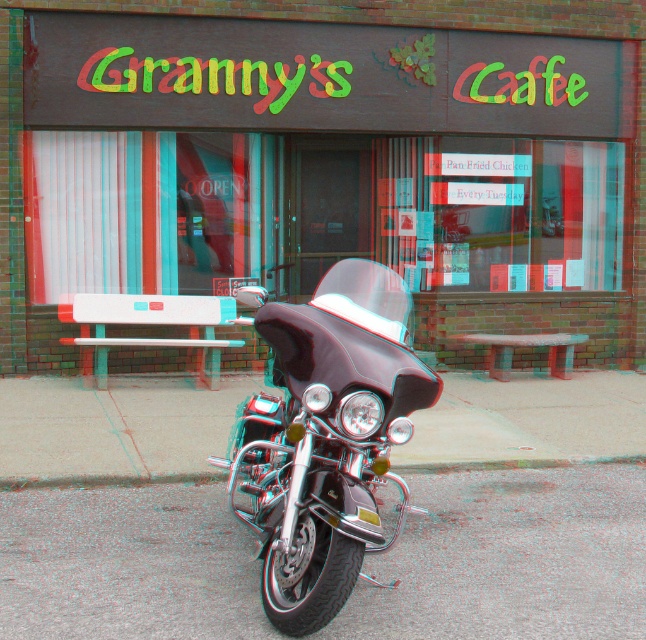
You are standing in front of Granny Caffe and want to take a photo of the storefront. You notice two points marked on the ground at coordinates point [428,168] and point [309,307]. Which point should you stand on to ensure the storefront is fully visible in your photo?

You should stand on point [428,168] because it is closer to the viewer, allowing for a better view of the storefront compared to point [309,307] which is farther away.

You are a delivery person who needs to park your motorcycle exactly 5 meters away from the brick wall at center. Can you park your shiny chrome motorbike at center in the current position?

The distance between the brick wall at center and the shiny chrome motorbike at center is 7.26 meters, which is more than 5 meters. Therefore, you cannot park the shiny chrome motorbike at center in the current position to meet the requirement.